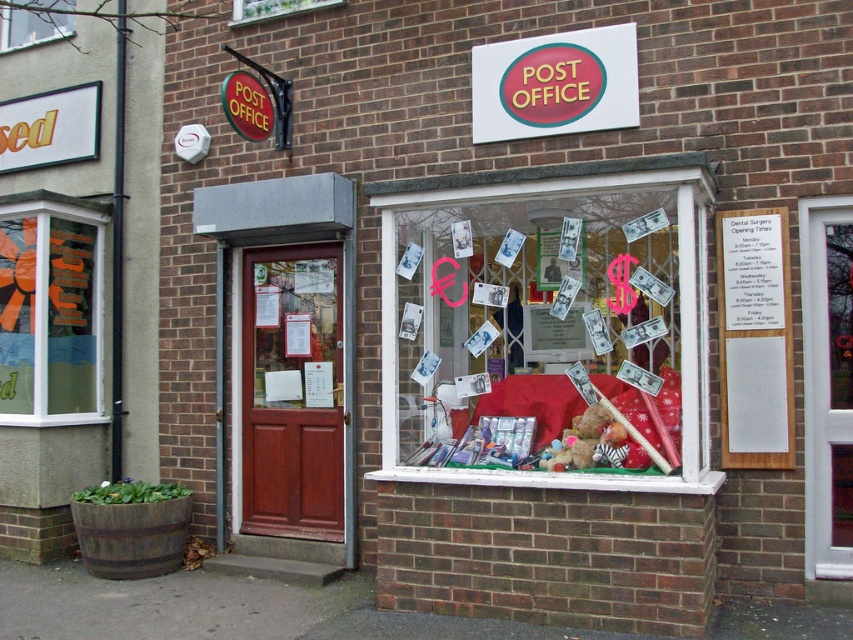
Question: Estimate the real-world distances between objects in this image. Which object is closer to the transparent glass window at left?

Choices:
 (A) transparent glass window at upper center
 (B) clear glass window at upper center
 (C) matte plastic sign at upper center
 (D) white paperboard at center

Answer: (A)

Question: Is white plastic door at center bigger than matte plastic sign at upper center?

Choices:
 (A) yes
 (B) no

Answer: (B)

Question: Among these points, which one is farthest from the camera?

Choices:
 (A) (256, 8)
 (B) (485, 275)

Answer: (A)

Question: Does transparent glass window at left appear on the right side of white paperboard at center?

Choices:
 (A) yes
 (B) no

Answer: (B)

Question: Which object is positioned farthest from the transparent glass window at upper center?

Choices:
 (A) white paperboard at center
 (B) translucent glass window at center

Answer: (A)

Question: Does translucent glass window at center appear on the right side of white plastic door at center?

Choices:
 (A) yes
 (B) no

Answer: (B)